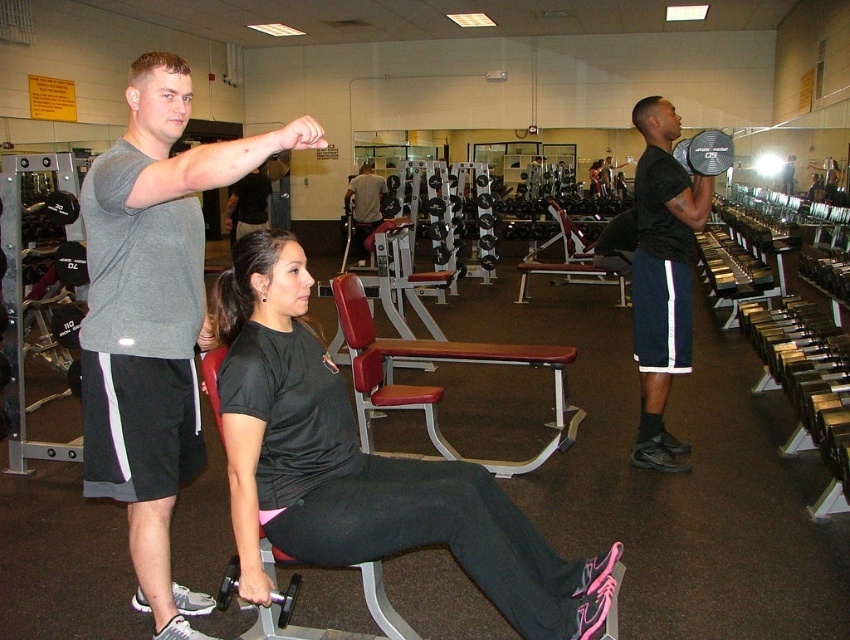
Question: Among these objects, which one is farthest from the camera?

Choices:
 (A) red leather bench at center
 (B) matte gray shirt at center

Answer: (B)

Question: Which of the following is the farthest from the observer?

Choices:
 (A) (570, 433)
 (B) (660, 109)
 (C) (357, 232)

Answer: (C)

Question: Where is black matte dumbbell at right located in relation to matte gray shirt at center in the image?

Choices:
 (A) right
 (B) left

Answer: (A)

Question: Is black matte shirt at center behind matte gray shirt at center?

Choices:
 (A) no
 (B) yes

Answer: (A)

Question: Is red leather bench at center to the left of matte gray shirt at center from the viewer's perspective?

Choices:
 (A) yes
 (B) no

Answer: (B)

Question: Estimate the real-world distances between objects in this image. Which object is closer to the black matte dumbbell at right?

Choices:
 (A) red leather bench at center
 (B) gray cotton t-shirt at upper left

Answer: (A)